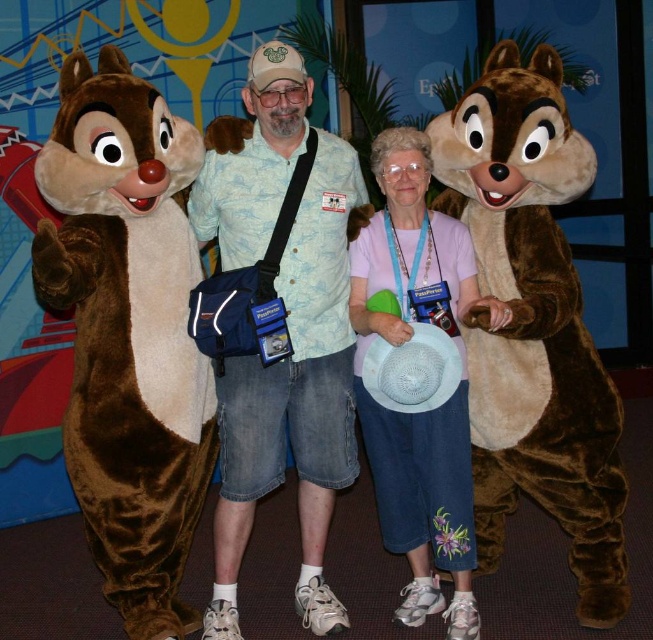
Question: Which object is positioned farthest from the fuzzy brown chipmunk at right?

Choices:
 (A) velvety brown costume at center
 (B) pink fabric shirt at center
 (C) brown plush chipmunk at left

Answer: (C)

Question: Is fuzzy brown chipmunk at right below pink fabric shirt at center?

Choices:
 (A) no
 (B) yes

Answer: (A)

Question: Which object is positioned closest to the brown plush chipmunk at left?

Choices:
 (A) fuzzy brown chipmunk at right
 (B) velvety brown costume at center
 (C) pink fabric shirt at center

Answer: (B)

Question: Which point is closer to the camera taking this photo?

Choices:
 (A) (223, 392)
 (B) (387, 534)
 (C) (146, 157)

Answer: (C)

Question: Does fuzzy brown chipmunk at right have a smaller size compared to velvety brown costume at center?

Choices:
 (A) yes
 (B) no

Answer: (B)

Question: Does brown plush chipmunk at left appear on the right side of velvety brown costume at center?

Choices:
 (A) no
 (B) yes

Answer: (A)